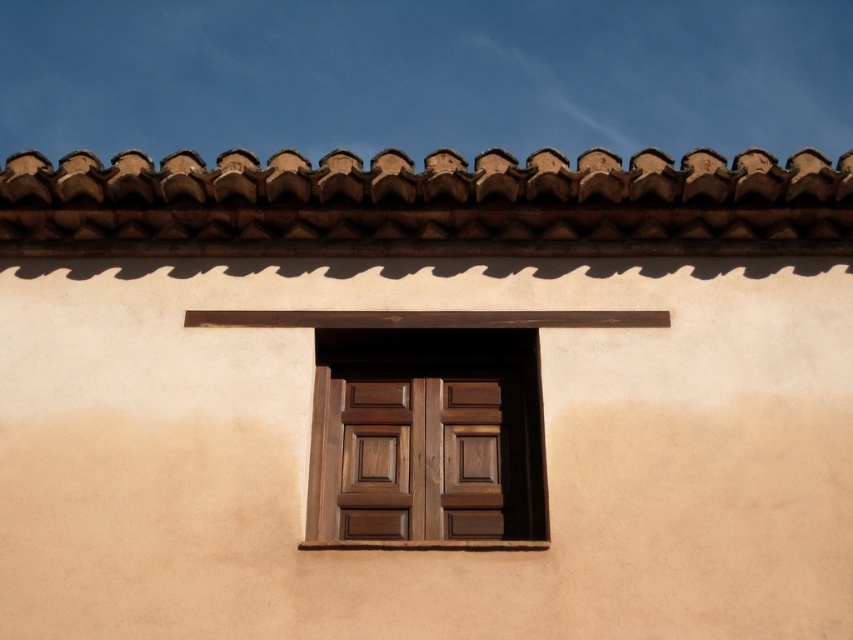
Does brown textured tiles at top come in front of dark wood window at center?

No, it is not.

Is point (496, 163) more distant than point (440, 372)?

No, (496, 163) is in front of (440, 372).

What do you see at coordinates (426, 204) in the screenshot? I see `brown textured tiles at top` at bounding box center [426, 204].

Image resolution: width=853 pixels, height=640 pixels. Find the location of `brown textured tiles at top`. brown textured tiles at top is located at coordinates (426, 204).